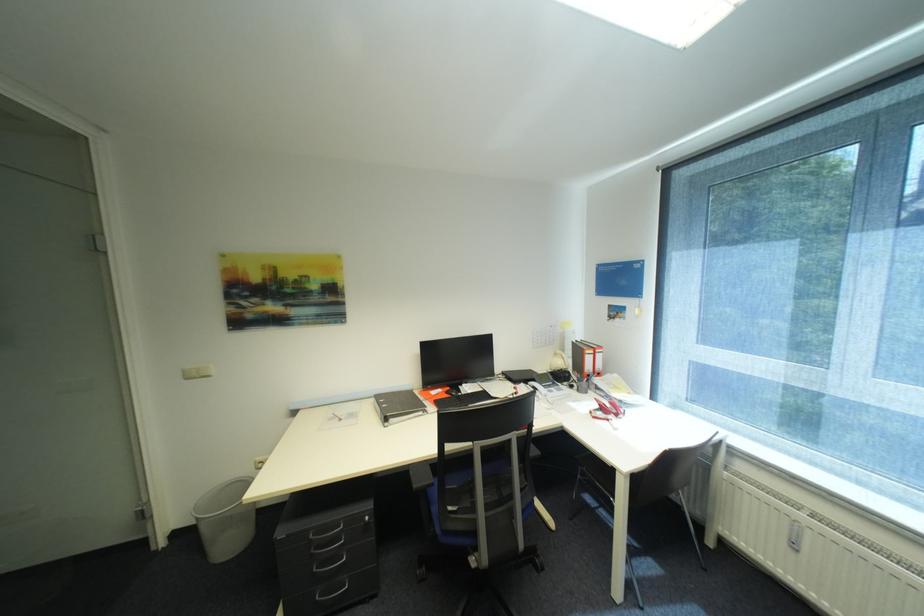
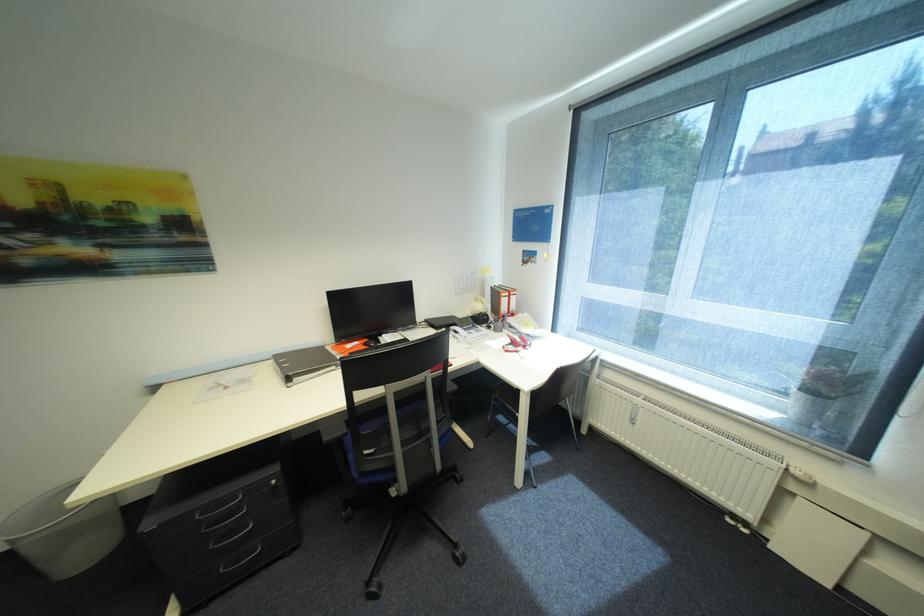
Locate, in the second image, the point that corresponds to [492,487] in the first image.

(407, 426)